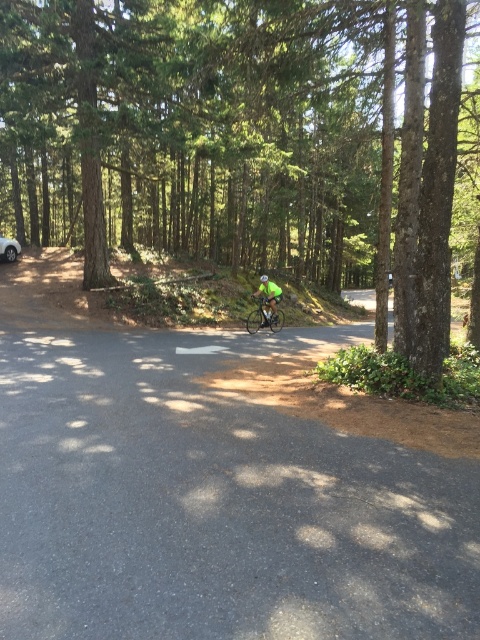
Between shiny metallic bicycle at center and neon green jersey at center, which one has more height?

With more height is neon green jersey at center.

Can you confirm if shiny metallic bicycle at center is bigger than neon green jersey at center?

No.

This screenshot has height=640, width=480. What do you see at coordinates (264, 316) in the screenshot? I see `shiny metallic bicycle at center` at bounding box center [264, 316].

Where is `shiny metallic bicycle at center`? shiny metallic bicycle at center is located at coordinates (264, 316).

Is point (158, 8) farther from camera compared to point (266, 312)?

Yes, it is behind point (266, 312).

Is brown rough tree at center closer to the viewer compared to shiny metallic bicycle at center?

Yes, it is in front of shiny metallic bicycle at center.

Identify the location of brown rough tree at center. (195, 129).

Between brown rough tree at center and silver metallic car at left, which one has more height?

Standing taller between the two is brown rough tree at center.

Measure the distance between brown rough tree at center and camera.

brown rough tree at center and camera are 6.29 meters apart from each other.

Locate an element on the screen. This screenshot has width=480, height=640. brown rough tree at center is located at coordinates (195, 129).